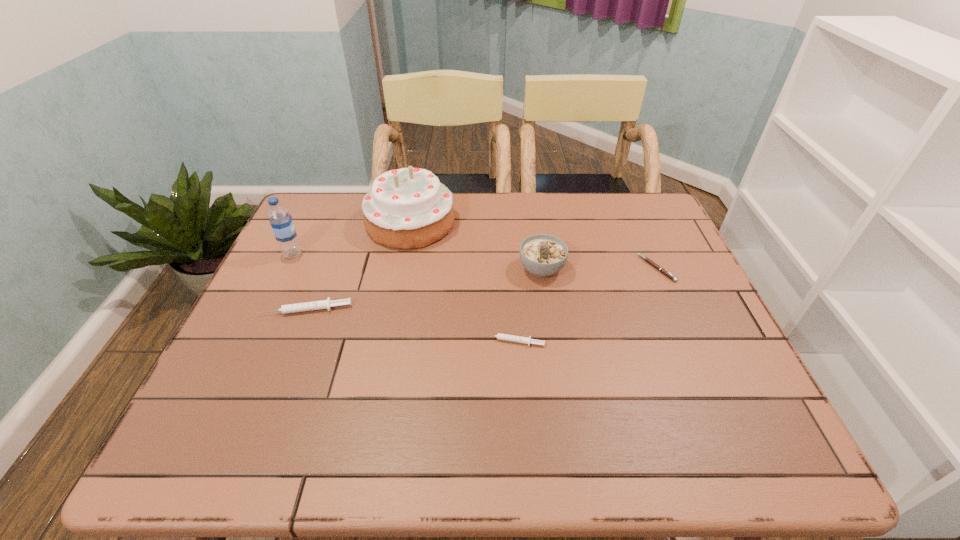
Please point a free position for a syringe on the right. Please provide its 2D coordinates. Your answer should be formatted as a tuple, i.e. [(x, y)], where the tuple contains the x and y coordinates of a point satisfying the conditions above.

[(752, 380)]